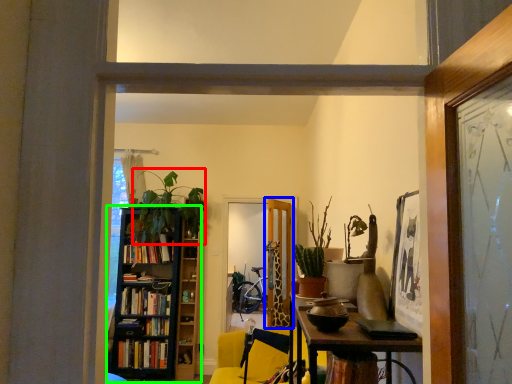
Question: Which object is positioned farthest from plant (highlighted by a red box)? Select from door (highlighted by a blue box) and bookcase (highlighted by a green box).

Choices:
 (A) door
 (B) bookcase

Answer: (A)